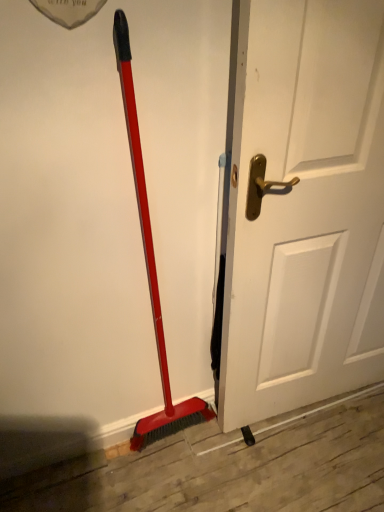
Question: Should I look upward or downward to see white matte door at center?

Choices:
 (A) down
 (B) up

Answer: (A)